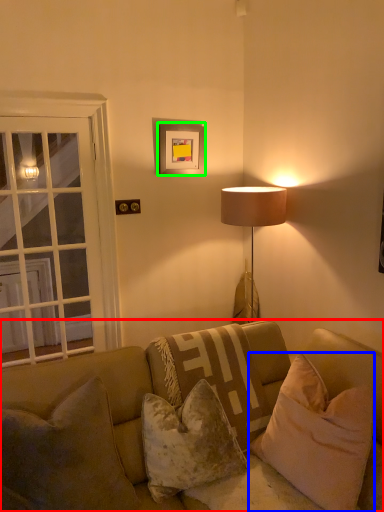
Question: Considering the real-world distances, which object is closest to studio couch (highlighted by a red box)? pillow (highlighted by a blue box) or picture frame (highlighted by a green box).

Choices:
 (A) pillow
 (B) picture frame

Answer: (A)